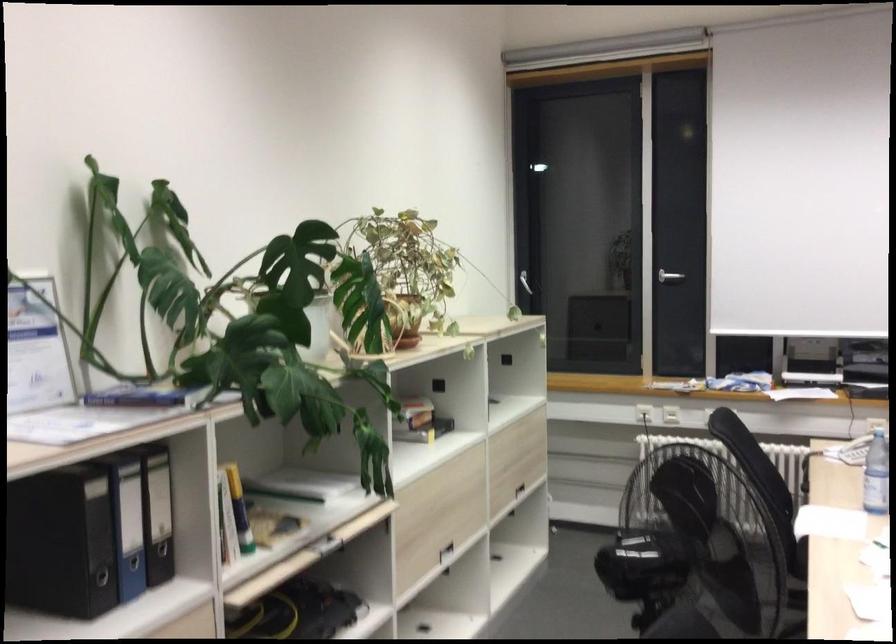
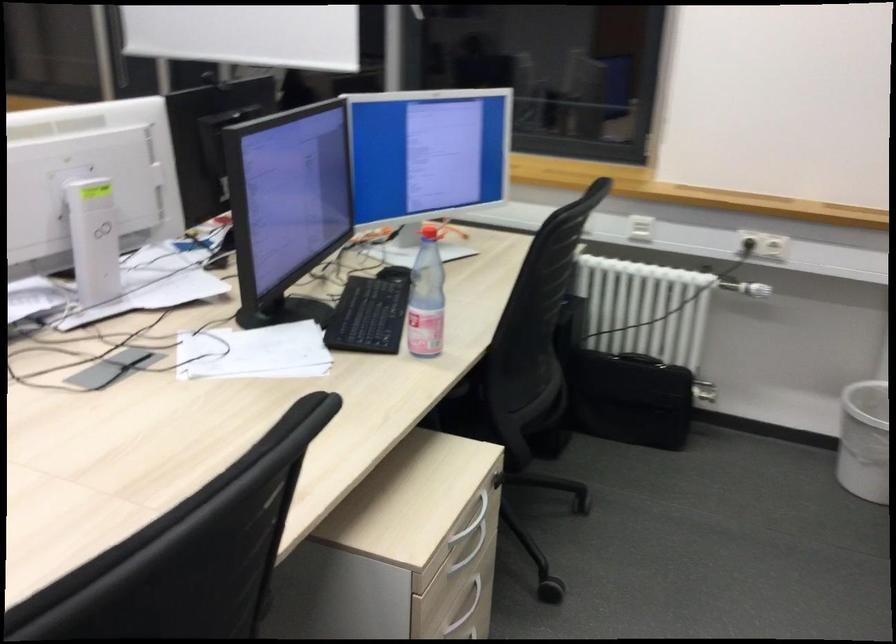
Question: What movement of the cameraman would produce the second image?

Choices:
 (A) Left
 (B) Right
 (C) Forward
 (D) Backward

Answer: (B)